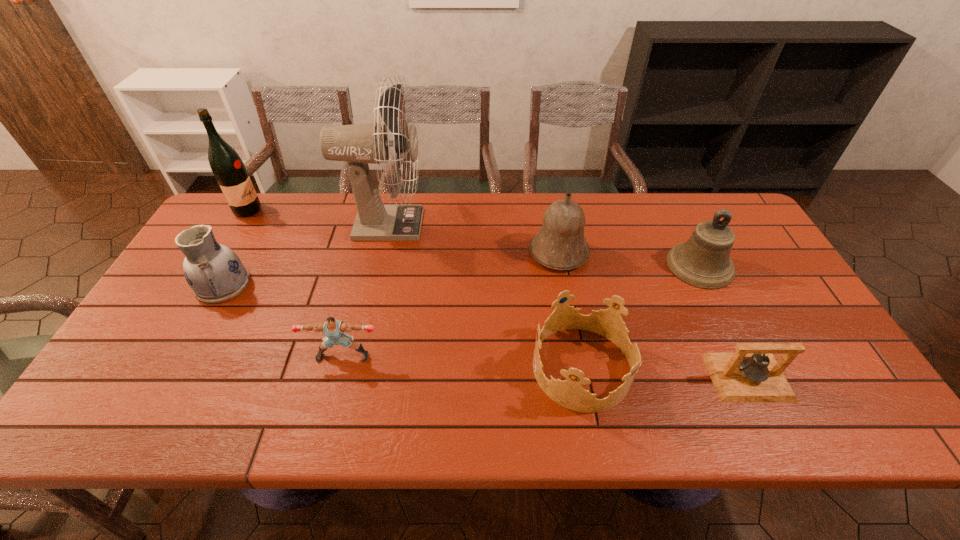
At what (x,y) coordinates should I click in order to perform the action: click on tiara located in the near edge section of the desktop. Please return your answer as a coordinate pair (x, y). This screenshot has height=540, width=960. Looking at the image, I should click on (x=569, y=393).

Find the location of `bell that is positioned at the near edge`. bell that is positioned at the near edge is located at coordinates (751, 374).

Where is `liquor that is at the left edge`? liquor that is at the left edge is located at coordinates (229, 170).

Where is `pottery located at the left edge`? This screenshot has height=540, width=960. pottery located at the left edge is located at coordinates (215, 273).

Where is `object that is at the far left corner`? This screenshot has height=540, width=960. object that is at the far left corner is located at coordinates (229, 170).

This screenshot has height=540, width=960. I want to click on object that is at the near right corner, so click(x=751, y=374).

This screenshot has width=960, height=540. In the image, there is a desktop. Identify the location of free space at the far edge. (482, 219).

Where is `free space at the near edge`? The image size is (960, 540). free space at the near edge is located at coordinates (550, 401).

Find the location of a particular element. vacant space at the left edge of the desktop is located at coordinates (129, 383).

Find the location of a particular element. The width and height of the screenshot is (960, 540). vacant area at the right edge is located at coordinates (850, 383).